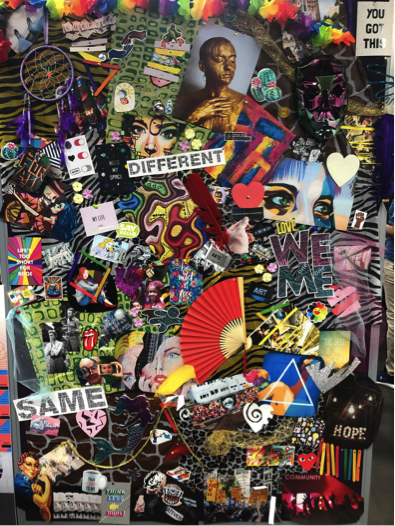
Locate an element on the screen. This screenshot has width=395, height=526. crayons is located at coordinates (337, 462).